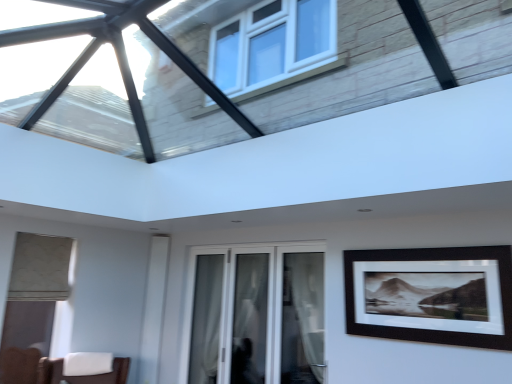
Question: Is white glass door at center facing towards white sheer curtain at center, which is counted as the 2th curtain, starting from the right?

Choices:
 (A) yes
 (B) no

Answer: (A)

Question: Is white glass door at center at the left side of white sheer curtain at center, positioned as the second curtain in front-to-back order?

Choices:
 (A) no
 (B) yes

Answer: (A)

Question: Can you confirm if white glass door at center is thinner than white sheer curtain at center, which is the first curtain from back to front?

Choices:
 (A) no
 (B) yes

Answer: (A)

Question: From the image's perspective, is white glass door at center above white sheer curtain at center, positioned as the second curtain in front-to-back order?

Choices:
 (A) yes
 (B) no

Answer: (A)

Question: From a real-world perspective, is white glass door at center positioned over white sheer curtain at center, positioned as the second curtain in front-to-back order, based on gravity?

Choices:
 (A) yes
 (B) no

Answer: (A)

Question: Can you confirm if white glass door at center is bigger than white sheer curtain at center, which is counted as the 2th curtain, starting from the right?

Choices:
 (A) yes
 (B) no

Answer: (A)

Question: From the image's perspective, is white glass door at center under white sheer curtain at center, which is counted as the first curtain, starting from the right?

Choices:
 (A) yes
 (B) no

Answer: (A)

Question: Would you say white glass door at center is outside white sheer curtain at center, which appears as the first curtain when viewed from the front?

Choices:
 (A) yes
 (B) no

Answer: (A)

Question: Is white glass door at center smaller than white sheer curtain at center, which appears as the first curtain when viewed from the front?

Choices:
 (A) yes
 (B) no

Answer: (B)

Question: Is white glass door at center facing towards white sheer curtain at center, which is counted as the first curtain, starting from the right?

Choices:
 (A) yes
 (B) no

Answer: (A)

Question: Can you confirm if white glass door at center is taller than white sheer curtain at center, the second curtain in the left-to-right sequence?

Choices:
 (A) yes
 (B) no

Answer: (A)

Question: Is white glass door at center at the right side of white sheer curtain at center, which appears as the first curtain when viewed from the front?

Choices:
 (A) yes
 (B) no

Answer: (B)

Question: From a real-world perspective, is white sheer curtain at center, which is counted as the 2th curtain, starting from the right, positioned under white sheer curtain at center, which is counted as the first curtain, starting from the right, based on gravity?

Choices:
 (A) yes
 (B) no

Answer: (A)